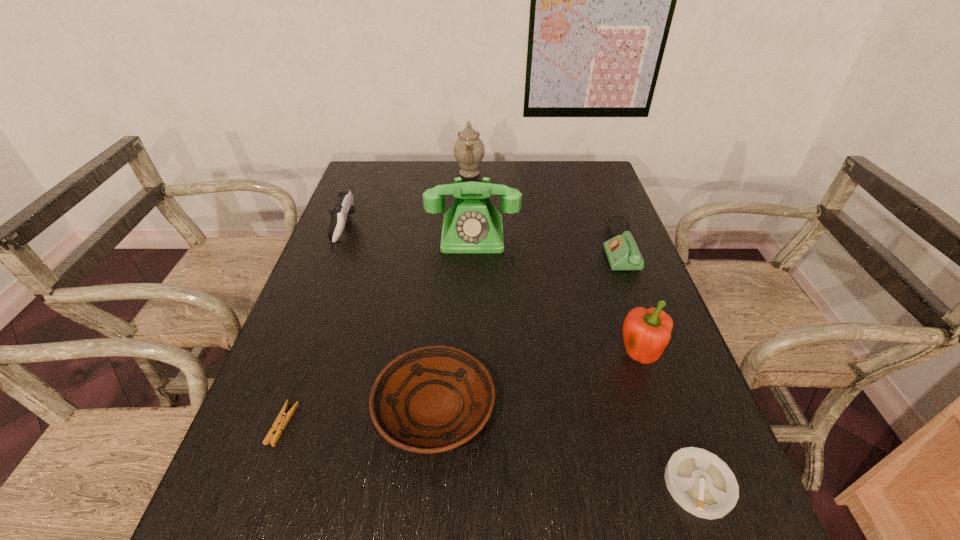
Identify the location of blank region between the fourth tallest object and the plate. Image resolution: width=960 pixels, height=540 pixels. (390, 318).

Find the location of a particular element. The width and height of the screenshot is (960, 540). free point between the pepper and the second shortest object is located at coordinates (669, 421).

Where is `vacant space that is in between the chinaware and the control`? vacant space that is in between the chinaware and the control is located at coordinates (407, 200).

Where is `vacant area between the left telephone and the pepper`? The height and width of the screenshot is (540, 960). vacant area between the left telephone and the pepper is located at coordinates (556, 296).

The width and height of the screenshot is (960, 540). Find the location of `empty space that is in between the plate and the fourth tallest object`. empty space that is in between the plate and the fourth tallest object is located at coordinates (390, 318).

Image resolution: width=960 pixels, height=540 pixels. Find the location of `free spot between the farthest object and the right telephone`. free spot between the farthest object and the right telephone is located at coordinates (544, 210).

I want to click on free spot between the pepper and the chinaware, so click(554, 265).

The height and width of the screenshot is (540, 960). What are the coordinates of `object that is the fifth nearest to the pepper` in the screenshot? It's located at pyautogui.click(x=282, y=419).

Choose which object is the sixth nearest neighbor to the ashtray. Please provide its 2D coordinates. Your answer should be formatted as a tuple, i.e. [(x, y)], where the tuple contains the x and y coordinates of a point satisfying the conditions above.

[(344, 207)]

At what (x,y) coordinates should I click in order to perform the action: click on free space that satisfies the following two spatial constraints: 1. on the front-facing side of the fifth shortest object; 2. on the right side of the ashtray. Please return your answer as a coordinate pair (x, y). Image resolution: width=960 pixels, height=540 pixels. Looking at the image, I should click on (247, 484).